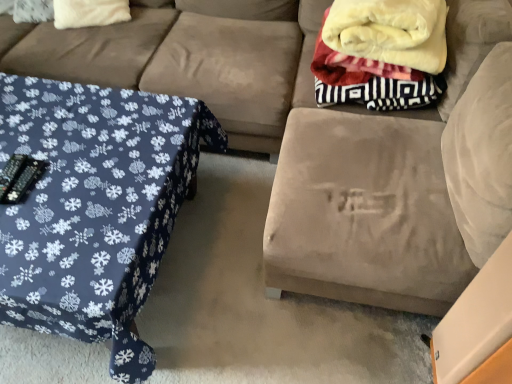
Question: Is suede ottoman at center at the back of soft fleece blanket at upper right?

Choices:
 (A) yes
 (B) no

Answer: (A)

Question: From the image's perspective, is soft fleece blanket at upper right on suede ottoman at center?

Choices:
 (A) no
 (B) yes

Answer: (B)

Question: Is there a large distance between soft fleece blanket at upper right and suede ottoman at center?

Choices:
 (A) yes
 (B) no

Answer: (B)

Question: From the image's perspective, is soft fleece blanket at upper right below suede ottoman at center?

Choices:
 (A) yes
 (B) no

Answer: (B)

Question: Can you confirm if soft fleece blanket at upper right is wider than suede ottoman at center?

Choices:
 (A) no
 (B) yes

Answer: (A)

Question: Does soft fleece blanket at upper right lie behind suede ottoman at center?

Choices:
 (A) yes
 (B) no

Answer: (A)

Question: Considering the relative sizes of blue fabric table at left and suede couch at upper left in the image provided, is blue fabric table at left taller than suede couch at upper left?

Choices:
 (A) no
 (B) yes

Answer: (A)

Question: Is blue fabric table at left to the right of suede couch at upper left from the viewer's perspective?

Choices:
 (A) yes
 (B) no

Answer: (A)

Question: Is blue fabric table at left not near suede couch at upper left?

Choices:
 (A) yes
 (B) no

Answer: (B)

Question: Considering the relative positions of blue fabric table at left and suede couch at upper left in the image provided, is blue fabric table at left to the left of suede couch at upper left from the viewer's perspective?

Choices:
 (A) yes
 (B) no

Answer: (B)

Question: Does blue fabric table at left have a smaller size compared to suede couch at upper left?

Choices:
 (A) yes
 (B) no

Answer: (A)

Question: From a real-world perspective, is blue fabric table at left physically below suede couch at upper left?

Choices:
 (A) yes
 (B) no

Answer: (A)

Question: Is suede couch at upper left not within white fluffy pillow at upper left?

Choices:
 (A) no
 (B) yes

Answer: (B)